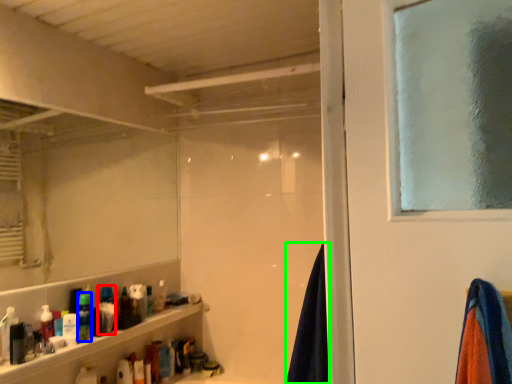
Question: Which object is positioned farthest from toiletry (highlighted by a red box)? Select from toiletry (highlighted by a blue box) and beach towel (highlighted by a green box).

Choices:
 (A) toiletry
 (B) beach towel

Answer: (B)